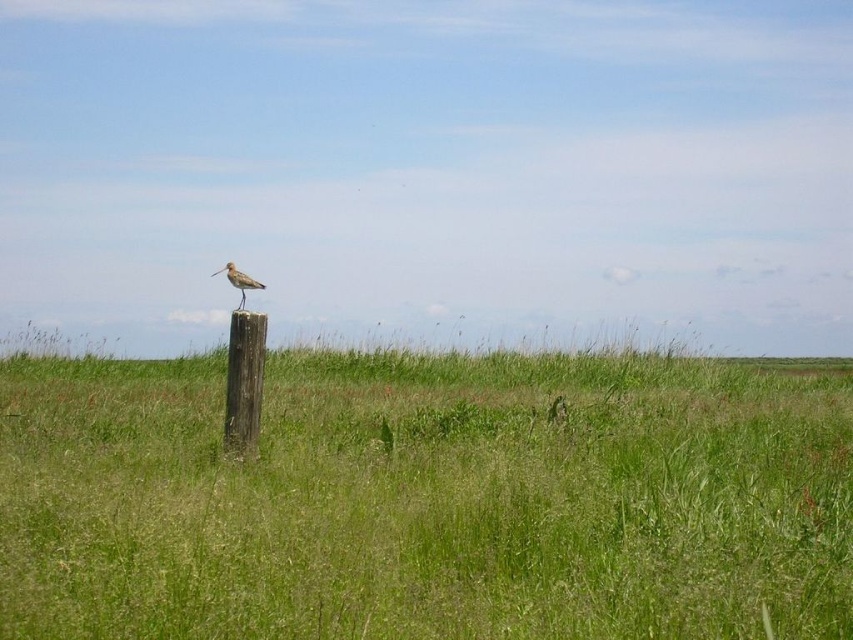
Who is positioned more to the right, brown wooden post at center or brown speckled feathered bird at center?

brown wooden post at center

Between brown wooden post at center and brown speckled feathered bird at center, which one has more height?

brown wooden post at center is taller.

Locate an element on the screen. The height and width of the screenshot is (640, 853). brown wooden post at center is located at coordinates (244, 381).

Locate an element on the screen. The width and height of the screenshot is (853, 640). brown wooden post at center is located at coordinates (244, 381).

Who is more distant from viewer, (634, 396) or (228, 272)?

Positioned behind is point (634, 396).

Does green grassy field at center have a greater height compared to brown speckled feathered bird at center?

Yes.

Describe the element at coordinates (426, 499) in the screenshot. The height and width of the screenshot is (640, 853). I see `green grassy field at center` at that location.

Identify the location of green grassy field at center. (426, 499).

Between green grassy field at center and brown wooden post at center, which one appears on the left side from the viewer's perspective?

brown wooden post at center is more to the left.

Is green grassy field at center smaller than brown wooden post at center?

Actually, green grassy field at center might be larger than brown wooden post at center.

This screenshot has height=640, width=853. I want to click on green grassy field at center, so click(x=426, y=499).

What are the coordinates of `green grassy field at center` in the screenshot? It's located at (426, 499).